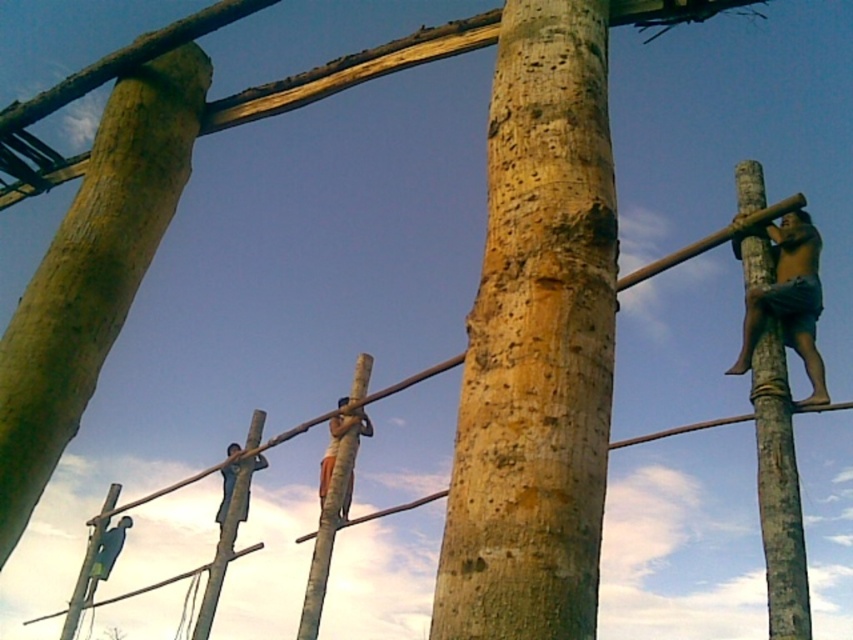
Question: Is natural wood pole at center below smooth brown pole at center?

Choices:
 (A) no
 (B) yes

Answer: (A)

Question: Which of the following is the closest to the observer?

Choices:
 (A) brown wooden pole at upper right
 (B) orange fabric at center

Answer: (A)

Question: Is smooth brown pole at right below smooth brown pole at center?

Choices:
 (A) yes
 (B) no

Answer: (B)

Question: Does smooth wooden pole at lower left have a smaller size compared to wooden pole at center?

Choices:
 (A) yes
 (B) no

Answer: (B)

Question: Which of the following is the closest to the observer?

Choices:
 (A) pyautogui.click(x=368, y=369)
 (B) pyautogui.click(x=222, y=499)

Answer: (A)

Question: Among these objects, which one is nearest to the camera?

Choices:
 (A) natural wood pole at center
 (B) green painted wood pole at lower left

Answer: (A)